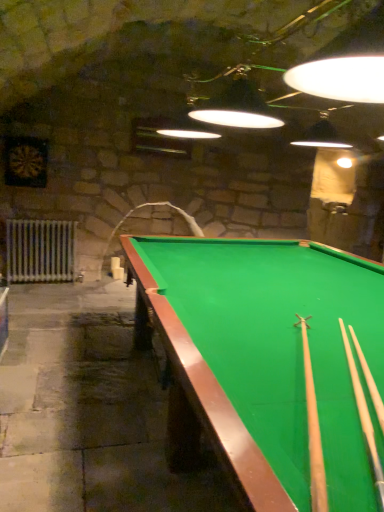
Question: Would you consider white metallic radiator at left to be distant from light brown wood cue at center, the 2th cue viewed from the right?

Choices:
 (A) no
 (B) yes

Answer: (B)

Question: Considering the relative sizes of white metallic radiator at left and light brown wood cue at center, which appears as the 1th cue when viewed from the left, in the image provided, is white metallic radiator at left smaller than light brown wood cue at center, which appears as the 1th cue when viewed from the left,?

Choices:
 (A) yes
 (B) no

Answer: (B)

Question: Can you confirm if white metallic radiator at left is thinner than light brown wood cue at center, the 2th cue viewed from the right?

Choices:
 (A) yes
 (B) no

Answer: (A)

Question: From a real-world perspective, is white metallic radiator at left located beneath light brown wood cue at center, which appears as the 1th cue when viewed from the left?

Choices:
 (A) yes
 (B) no

Answer: (A)

Question: Is white metallic radiator at left with light brown wood cue at center, which appears as the 1th cue when viewed from the left?

Choices:
 (A) no
 (B) yes

Answer: (A)

Question: Is white metallic radiator at left facing towards light brown wood cue at center, the 2th cue viewed from the right?

Choices:
 (A) no
 (B) yes

Answer: (B)

Question: From a real-world perspective, is light wood cue at right, which appears as the second cue when viewed from the left, below green felt billiard table at center?

Choices:
 (A) no
 (B) yes

Answer: (A)

Question: Is the position of light wood cue at right, which appears as the second cue when viewed from the left, less distant than that of green felt billiard table at center?

Choices:
 (A) yes
 (B) no

Answer: (B)

Question: Would you consider light wood cue at right, which appears as the second cue when viewed from the left, to be distant from green felt billiard table at center?

Choices:
 (A) no
 (B) yes

Answer: (A)

Question: Can you confirm if light wood cue at right, which appears as the 1th cue when viewed from the right, is wider than green felt billiard table at center?

Choices:
 (A) no
 (B) yes

Answer: (A)

Question: Does light wood cue at right, which appears as the second cue when viewed from the left, appear on the right side of green felt billiard table at center?

Choices:
 (A) yes
 (B) no

Answer: (B)

Question: Is light wood cue at right, which appears as the 1th cue when viewed from the right, oriented away from green felt billiard table at center?

Choices:
 (A) no
 (B) yes

Answer: (B)

Question: Can you confirm if white metallic radiator at left is positioned to the left of light wood cue at right, which appears as the second cue when viewed from the left?

Choices:
 (A) no
 (B) yes

Answer: (B)